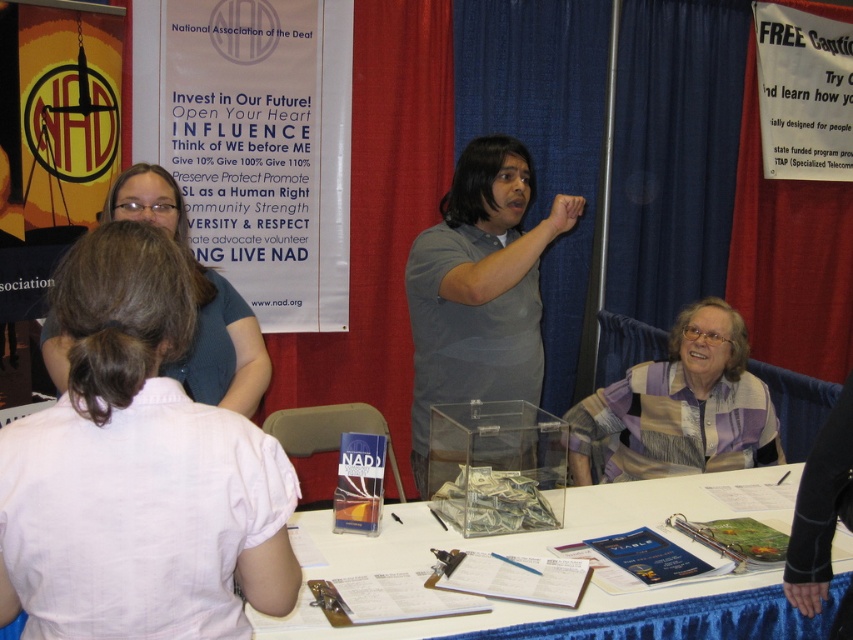
Is the position of clear plastic table at center less distant than that of matte blue shirt at upper left?

Yes.

Is clear plastic table at center shorter than matte blue shirt at upper left?

Yes.

At what (x,y) coordinates should I click in order to perform the action: click on clear plastic table at center. Please return your answer as a coordinate pair (x, y). This screenshot has width=853, height=640. Looking at the image, I should click on (543, 531).

You are a GUI agent. You are given a task and a screenshot of the screen. Output one action in this format:
    pyautogui.click(x=<x>, y=<y>)
    Task: Click on the clear plastic table at center
    
    Given the screenshot: What is the action you would take?
    pyautogui.click(x=543, y=531)

Is gray cotton shirt at center wider than striped sweater at lower right?

Incorrect, gray cotton shirt at center's width does not surpass striped sweater at lower right's.

Find the location of a particular element. gray cotton shirt at center is located at coordinates (479, 288).

Which is behind, point (541, 236) or point (704, 456)?

Positioned behind is point (704, 456).

I want to click on gray cotton shirt at center, so coord(479,288).

Can you confirm if pink fabric shirt at upper left is positioned above matte blue shirt at upper left?

Actually, pink fabric shirt at upper left is below matte blue shirt at upper left.

Who is positioned more to the left, pink fabric shirt at upper left or matte blue shirt at upper left?

Positioned to the left is matte blue shirt at upper left.

Locate an element on the screen. The height and width of the screenshot is (640, 853). pink fabric shirt at upper left is located at coordinates (138, 470).